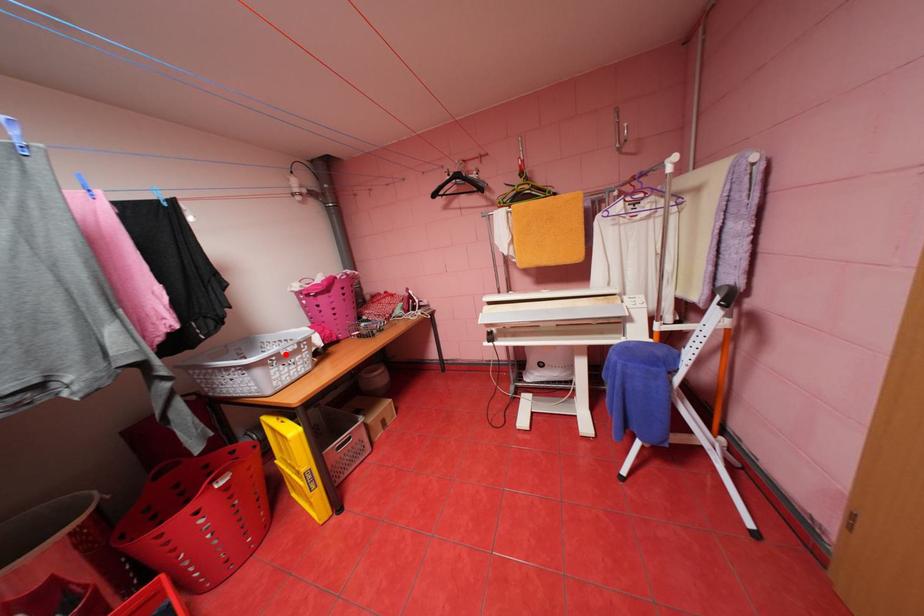
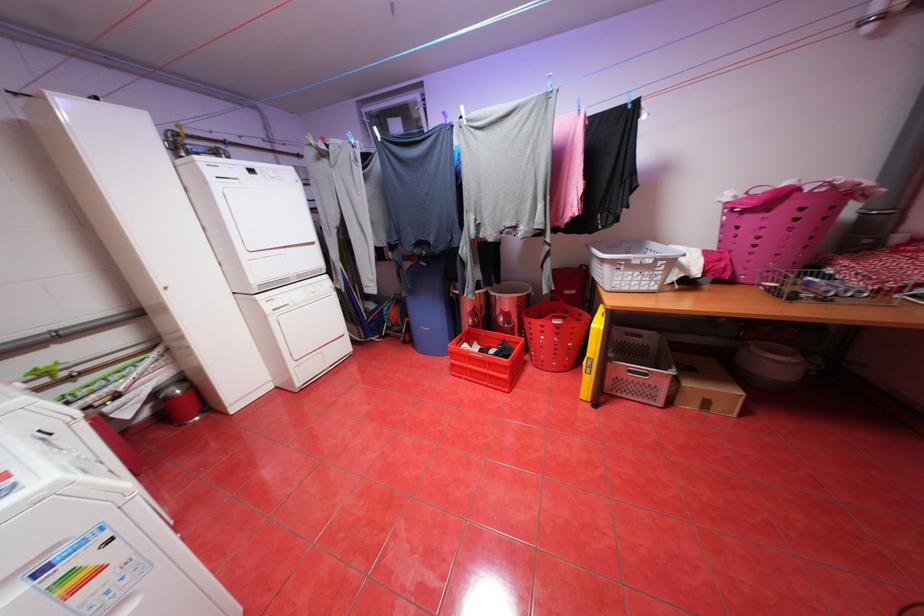
Where in the second image is the point corresponding to the highlighted location from the first image?

(637, 261)